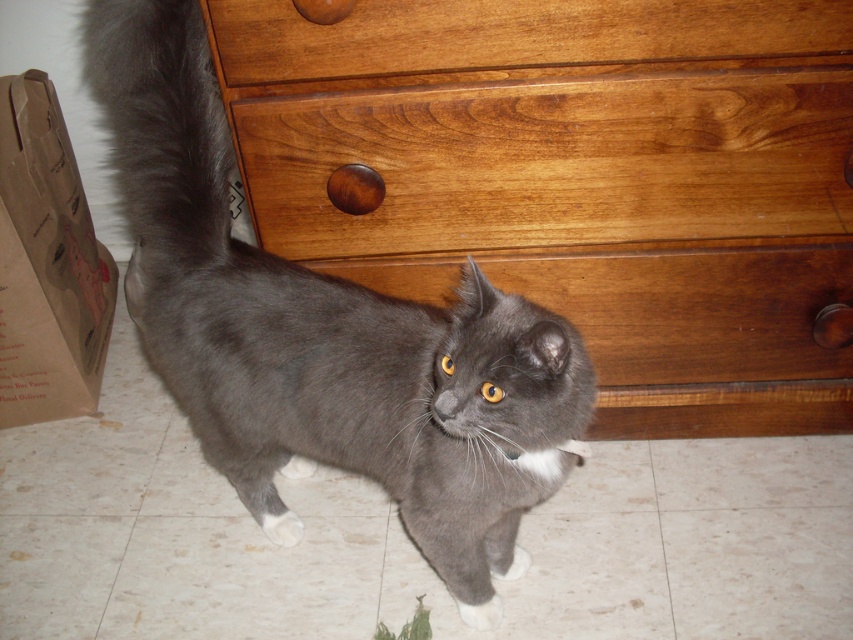
This screenshot has width=853, height=640. What do you see at coordinates (576, 179) in the screenshot? I see `wooden dresser at center` at bounding box center [576, 179].

Which is more to the left, wooden dresser at center or gray fur cat at center?

gray fur cat at center is more to the left.

Is point (717, 316) in front of point (259, 314)?

No, it is behind (259, 314).

Locate an element on the screen. wooden dresser at center is located at coordinates (576, 179).

Who is positioned more to the left, gray fur cat at center or gray fluffy tail at upper left?

gray fluffy tail at upper left

Identify the location of gray fur cat at center. The width and height of the screenshot is (853, 640). (325, 333).

Find the location of a particular element. The width and height of the screenshot is (853, 640). gray fur cat at center is located at coordinates (325, 333).

Is wooden drawer at center above gray fluffy tail at upper left?

No, wooden drawer at center is not above gray fluffy tail at upper left.

Describe the element at coordinates (554, 161) in the screenshot. This screenshot has height=640, width=853. I see `wooden drawer at center` at that location.

Locate an element on the screen. This screenshot has width=853, height=640. wooden drawer at center is located at coordinates (554, 161).